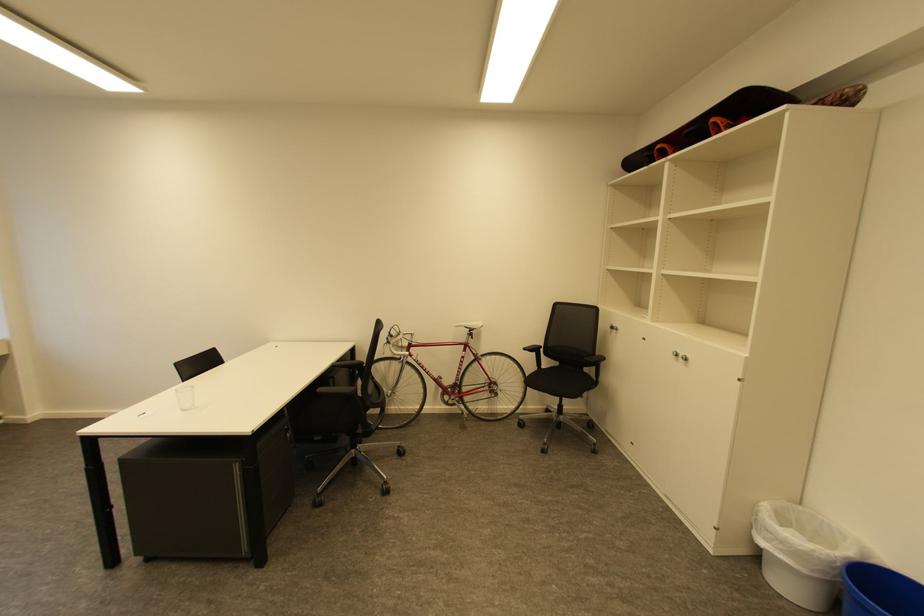
What do you see at coordinates (679, 359) in the screenshot?
I see `a filing cabinet handle` at bounding box center [679, 359].